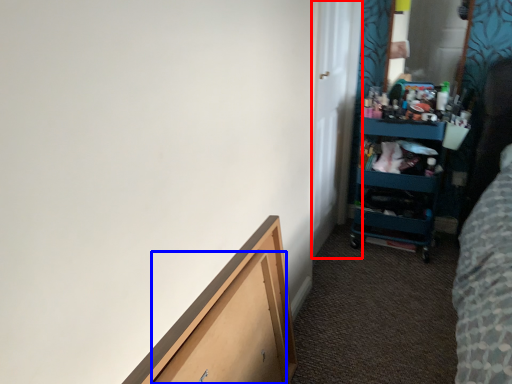
Question: Among these objects, which one is farthest to the camera, door (highlighted by a red box) or drawer (highlighted by a blue box)?

Choices:
 (A) door
 (B) drawer

Answer: (A)